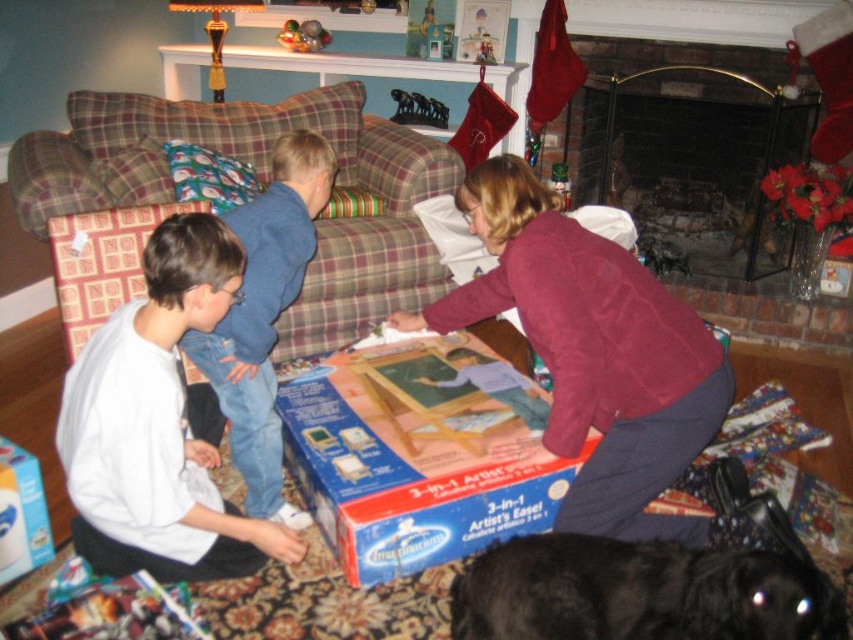
Can you confirm if white matte shirt at lower left is positioned to the left of blue denim jeans at left?

Correct, you'll find white matte shirt at lower left to the left of blue denim jeans at left.

This screenshot has width=853, height=640. What do you see at coordinates (157, 426) in the screenshot? I see `white matte shirt at lower left` at bounding box center [157, 426].

Locate an element on the screen. The height and width of the screenshot is (640, 853). white matte shirt at lower left is located at coordinates (157, 426).

Which is in front, point (621, 600) or point (289, 38)?

Point (621, 600) is in front.

How much distance is there between black fur dog at lower right and metallic silver toy at upper center?

black fur dog at lower right is 3.14 meters away from metallic silver toy at upper center.

This screenshot has width=853, height=640. What are the coordinates of `black fur dog at lower right` in the screenshot? It's located at (640, 593).

Consider the image. Which is more to the left, brick fireplace at right or blue denim jeans at left?

From the viewer's perspective, blue denim jeans at left appears more on the left side.

Is point (635, 154) positioned before point (277, 227)?

No, it is behind (277, 227).

Identify the location of brick fireplace at right. (688, 145).